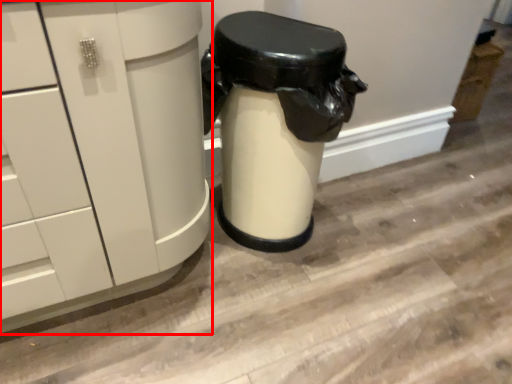
Question: From the image's perspective, what is the correct spatial positioning of cabinetry (annotated by the red box) in reference to garbage?

Choices:
 (A) above
 (B) below

Answer: (B)